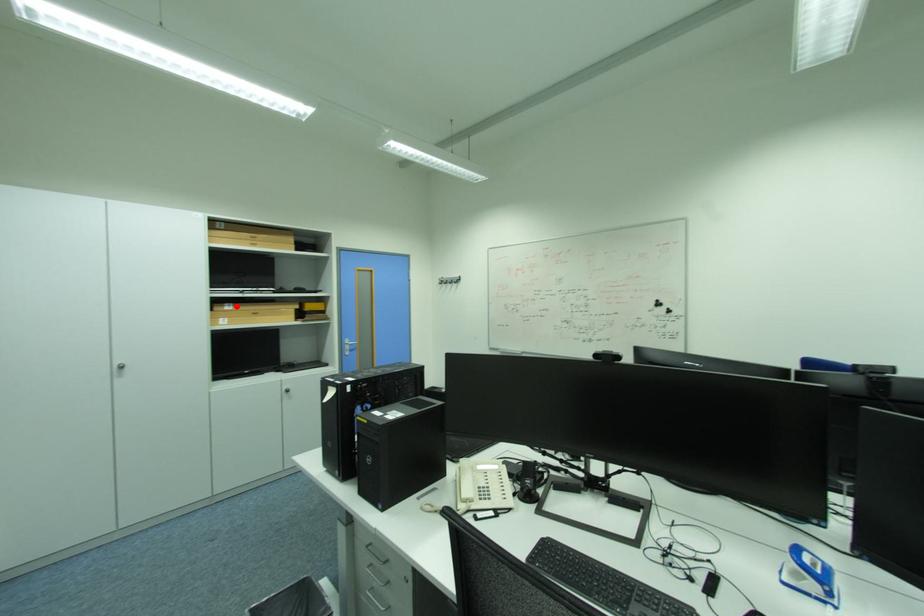
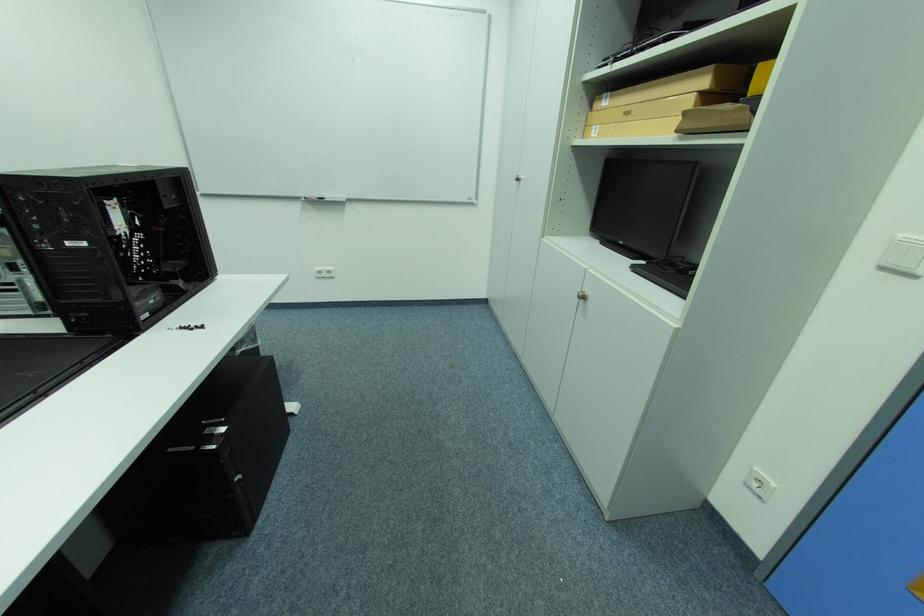
Question: I am providing you with two images of the same scene from different viewpoints. A red point is marked on the first image. Is the red point's position out of view in image 2?

Choices:
 (A) Yes
 (B) No

Answer: (B)